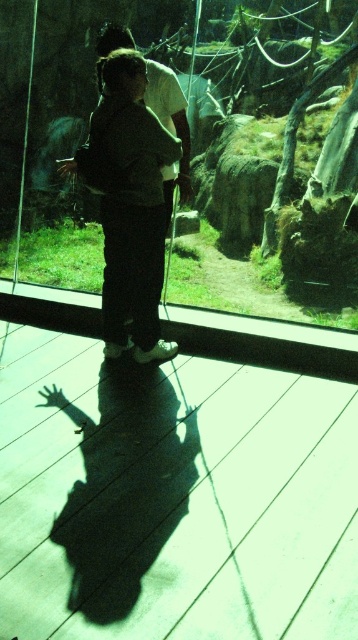
Does transparent glass door at center lie behind dark gray pants at center?

Yes, transparent glass door at center is further from the viewer.

Between transparent glass door at center and dark gray pants at center, which one appears on the left side from the viewer's perspective?

From the viewer's perspective, dark gray pants at center appears more on the left side.

Which is in front, point (312, 83) or point (122, 60)?

Point (122, 60) is more forward.

The image size is (358, 640). Identify the location of transparent glass door at center. (191, 148).